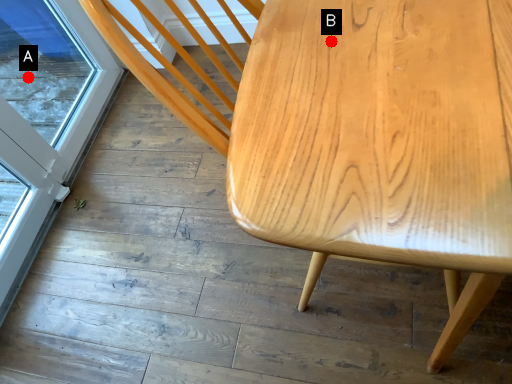
Question: Two points are circled on the image, labeled by A and B beside each circle. Which point is closer to the camera?

Choices:
 (A) A is closer
 (B) B is closer

Answer: (B)